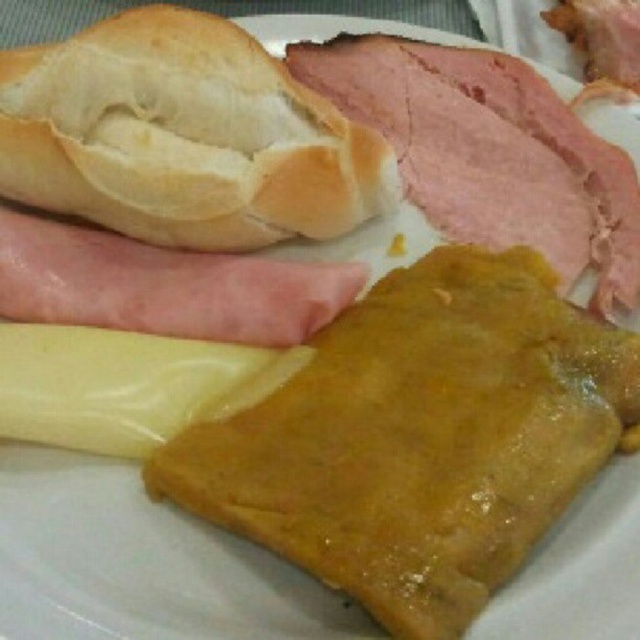
Who is more distant from viewer, (364, 200) or (83, 317)?

Positioned behind is point (364, 200).

What do you see at coordinates (182, 136) in the screenshot? I see `golden brown crusty bread at upper left` at bounding box center [182, 136].

Locate an element on the screen. The width and height of the screenshot is (640, 640). golden brown crusty bread at upper left is located at coordinates (182, 136).

Does golden-brown flaky pastry at center have a larger size compared to pink smooth ham at upper right?

Correct, golden-brown flaky pastry at center is larger in size than pink smooth ham at upper right.

Is golden-brown flaky pastry at center shorter than pink smooth ham at upper right?

In fact, golden-brown flaky pastry at center may be taller than pink smooth ham at upper right.

Is point (410, 280) farther from camera compared to point (608, 145)?

No, it is in front of (608, 145).

Identify the location of golden-brown flaky pastry at center. This screenshot has height=640, width=640. (419, 436).

Can you confirm if golden-brown flaky pastry at center is taller than yellowish matte cheese at center?

Yes.

Can you confirm if golden-brown flaky pastry at center is bigger than yellowish matte cheese at center?

Yes, golden-brown flaky pastry at center is bigger than yellowish matte cheese at center.

At what (x,y) coordinates should I click in order to perform the action: click on golden-brown flaky pastry at center. Please return your answer as a coordinate pair (x, y). The height and width of the screenshot is (640, 640). Looking at the image, I should click on (419, 436).

This screenshot has height=640, width=640. I want to click on golden-brown flaky pastry at center, so click(x=419, y=436).